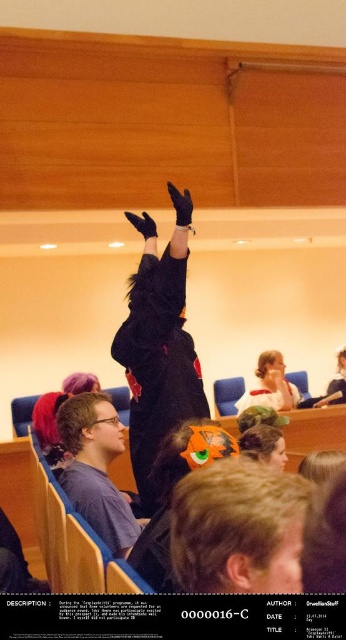
Which is more to the right, blonde hair at center or black plush at center?

From the viewer's perspective, blonde hair at center appears more on the right side.

Measure the distance between blonde hair at center and black plush at center.

blonde hair at center and black plush at center are 1.21 meters apart from each other.

Is point (180, 557) less distant than point (177, 269)?

That is True.

I want to click on blonde hair at center, so click(x=238, y=529).

Which is above, matte gray shirt at center or smooth plastic spoon at lower center?

Positioned higher is matte gray shirt at center.

Is point (70, 426) positioned behind point (268, 380)?

No, (70, 426) is closer to viewer.

This screenshot has height=640, width=346. I want to click on matte gray shirt at center, so click(95, 468).

Find the location of `matte gray shirt at center`. matte gray shirt at center is located at coordinates (95, 468).

Based on the photo, which is above, blonde hair at center or matte gray shirt at center?

blonde hair at center is above.

Between blonde hair at center and matte gray shirt at center, which one is positioned lower?

matte gray shirt at center is below.

The image size is (346, 640). Identify the location of blonde hair at center. (238, 529).